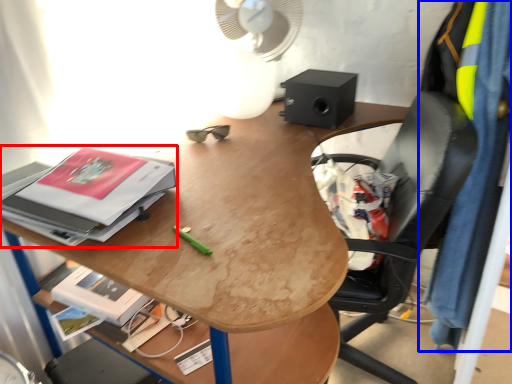
Question: Which object appears farthest to the camera in this image, paperback book (highlighted by a red box) or clothing (highlighted by a blue box)?

Choices:
 (A) paperback book
 (B) clothing

Answer: (B)